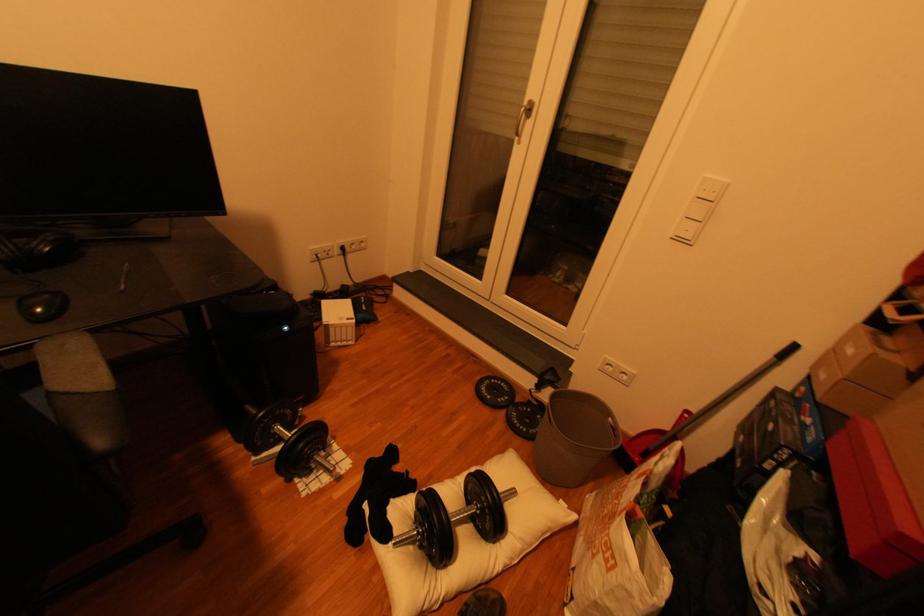
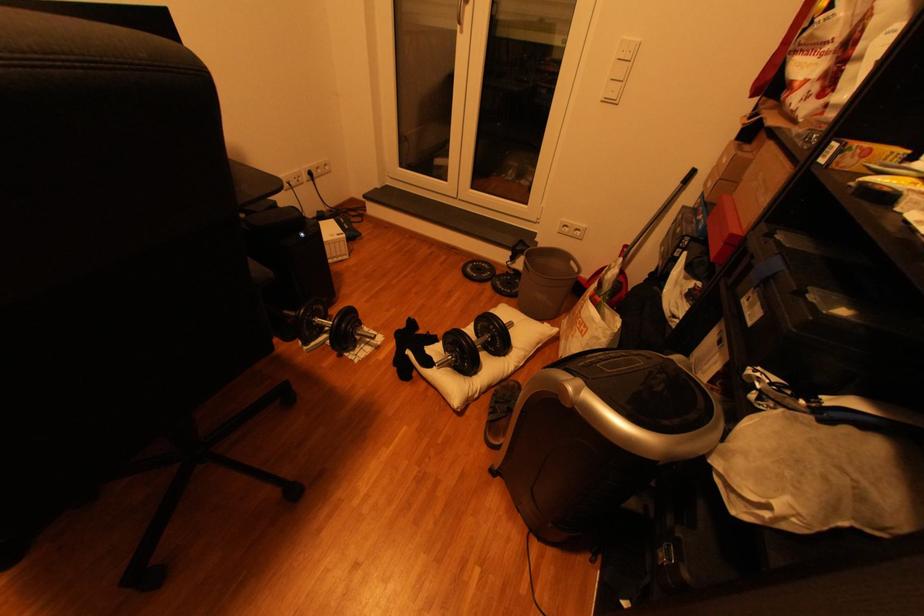
Where in the second image is the point corresponding to point 687,240 from the first image?

(614, 100)